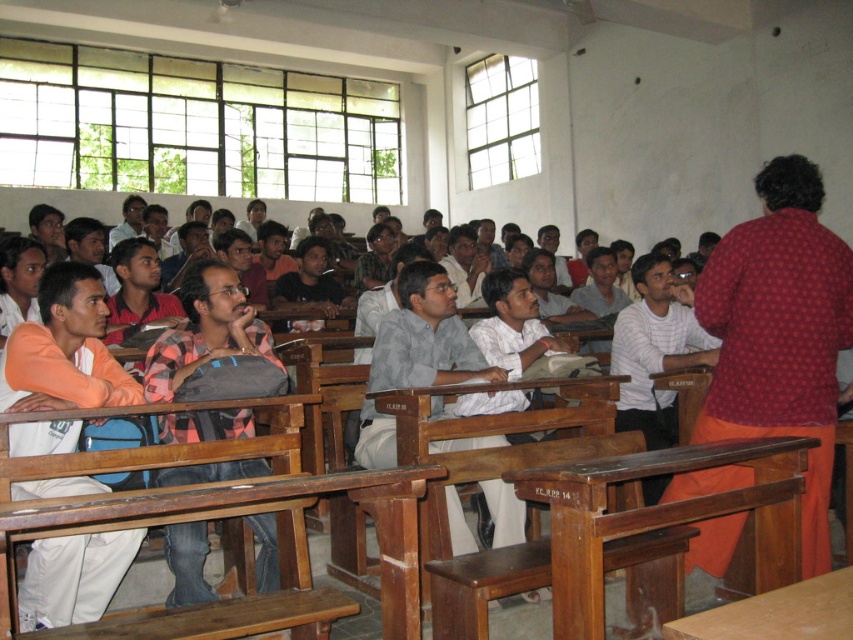
You are a student sitting in the classroom and want to locate the red dotted shirt at upper right. Where exactly is it positioned in the image?

The red dotted shirt at upper right is located at point (780, 332) in the image.

You are a student sitting in the classroom and want to know which of the two points, point (711, 548) or point (686, 531), is closer to you. Can you determine this based on their positions?

Point (711, 548) is further to the viewer than point (686, 531), so the closer point to you is point (686, 531).